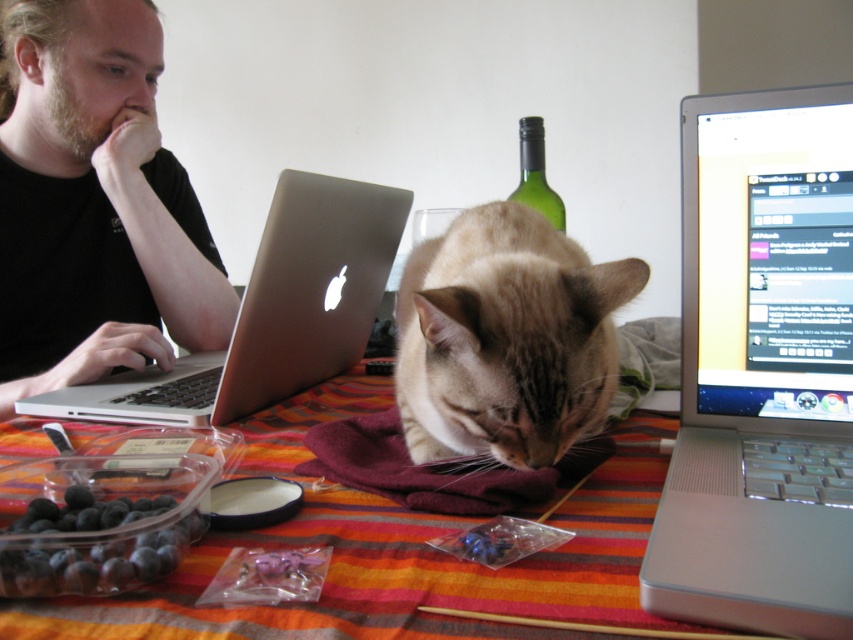
Question: Can you confirm if light brown fur cat at center is bigger than green glass bottle at upper center?

Choices:
 (A) no
 (B) yes

Answer: (B)

Question: Which point is farther to the camera?

Choices:
 (A) light brown fur cat at center
 (B) dark blue glossy berries at lower left
 (C) silver metallic laptop at upper right

Answer: (A)

Question: Is light brown fur cat at center positioned in front of green glass bottle at upper center?

Choices:
 (A) yes
 (B) no

Answer: (A)

Question: Among these points, which one is nearest to the camera?

Choices:
 (A) (553, 220)
 (B) (457, 282)
 (C) (848, 355)

Answer: (B)

Question: Is light brown fur cat at center to the left of green glass bottle at upper center from the viewer's perspective?

Choices:
 (A) no
 (B) yes

Answer: (B)

Question: Considering the real-world distances, which object is closest to the green glass bottle at upper center?

Choices:
 (A) striped fabric tablecloth at center
 (B) silver metallic laptop at upper right
 (C) light brown fur cat at center
 (D) satin gold laptop at left

Answer: (D)